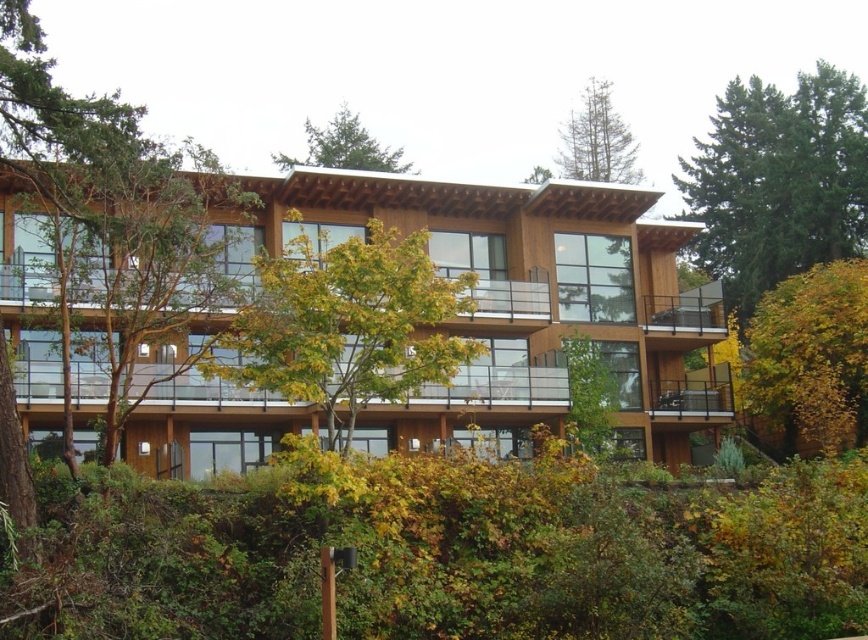
You are standing in front of the two story building and want to take a photo of both the yellow leafy tree at lower right and the green leafy tree at upper center. Which tree should you focus on first to ensure both are in clear view?

You should focus on the yellow leafy tree at lower right first since it is closer to the viewer than the green leafy tree at upper center, ensuring both are in clear focus when adjusting the camera settings.